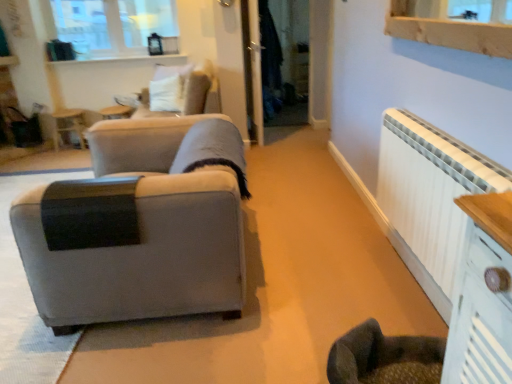
Where is `wooden side table at upper left`? The image size is (512, 384). wooden side table at upper left is located at coordinates (68, 125).

The height and width of the screenshot is (384, 512). What do you see at coordinates (180, 92) in the screenshot?
I see `velvet beige swivel chair at upper center` at bounding box center [180, 92].

I want to click on matte gray fabric couch at left, so click(141, 233).

What is the approximate height of matte gray fabric couch at left?

29.20 inches.

Based on the photo, measure the distance between clear glass window at upper left and camera.

clear glass window at upper left is 4.70 meters away from camera.

What do you see at coordinates (429, 197) in the screenshot? The height and width of the screenshot is (384, 512). I see `white painted radiator at right` at bounding box center [429, 197].

Where is `wooden side table at upper left`? wooden side table at upper left is located at coordinates (68, 125).

Would you say white painted radiator at right is a long distance from transparent glass door at center?

white painted radiator at right is positioned a significant distance from transparent glass door at center.

Which point is more forward, (453, 279) or (280, 125)?

The point (453, 279) is more forward.

Is white painted radiator at right turned away from transparent glass door at center?

No, transparent glass door at center is not at the back of white painted radiator at right.

Which of these two, white painted radiator at right or transparent glass door at center, stands shorter?

With less height is white painted radiator at right.

Based on the photo, from a real-world perspective, between velvet beige swivel chair at upper center and matte gray fabric couch at left, who is vertically higher?

velvet beige swivel chair at upper center, from a real-world perspective.

Would you say velvet beige swivel chair at upper center is a long distance from matte gray fabric couch at left?

Indeed, velvet beige swivel chair at upper center is not near matte gray fabric couch at left.

Does velvet beige swivel chair at upper center have a lesser width compared to matte gray fabric couch at left?

Yes.

From the image's perspective, is velvet beige swivel chair at upper center over matte gray fabric couch at left?

Yes, from the image's perspective, velvet beige swivel chair at upper center is over matte gray fabric couch at left.

Between velvet beige swivel chair at upper center and clear glass window at upper left, which one appears on the left side from the viewer's perspective?

From the viewer's perspective, clear glass window at upper left appears more on the left side.

Image resolution: width=512 pixels, height=384 pixels. I want to click on window located above the velvet beige swivel chair at upper center (from a real-world perspective), so click(x=115, y=26).

In the scene shown: Can you confirm if velvet beige swivel chair at upper center is shorter than clear glass window at upper left?

Yes, velvet beige swivel chair at upper center is shorter than clear glass window at upper left.

Which object is further away from the camera taking this photo, velvet beige swivel chair at upper center or clear glass window at upper left?

clear glass window at upper left is further away from the camera.

Which object is positioned more to the right, clear glass window at upper left or white glossy ledge at upper center?

white glossy ledge at upper center.

Is clear glass window at upper left aimed at white glossy ledge at upper center?

No, clear glass window at upper left is not facing towards white glossy ledge at upper center.

Is point (73, 3) closer to camera compared to point (156, 63)?

That is False.

Who is shorter, clear glass window at upper left or white glossy ledge at upper center?

With less height is white glossy ledge at upper center.

Between wooden side table at upper left and velvet beige swivel chair at upper center, which one is positioned behind?

wooden side table at upper left is further from the camera.

Which is more to the left, wooden side table at upper left or velvet beige swivel chair at upper center?

wooden side table at upper left.

Is wooden side table at upper left positioned with its back to velvet beige swivel chair at upper center?

No, wooden side table at upper left is not facing away from velvet beige swivel chair at upper center.

Image resolution: width=512 pixels, height=384 pixels. Identify the location of side table behind the velvet beige swivel chair at upper center. (68, 125).

In terms of width, does matte gray fabric couch at left look wider or thinner when compared to transparent glass door at center?

matte gray fabric couch at left is wider than transparent glass door at center.

Which of these two, matte gray fabric couch at left or transparent glass door at center, is smaller?

Smaller between the two is transparent glass door at center.

Are matte gray fabric couch at left and transparent glass door at center far apart?

Absolutely, matte gray fabric couch at left is distant from transparent glass door at center.

Can you confirm if white glossy ledge at upper center is positioned to the left of transparent glass door at center?

Correct, you'll find white glossy ledge at upper center to the left of transparent glass door at center.

Is white glossy ledge at upper center bigger or smaller than transparent glass door at center?

Clearly, white glossy ledge at upper center is smaller in size than transparent glass door at center.

Which is in front, point (150, 56) or point (263, 102)?

Positioned in front is point (263, 102).

Is white glossy ledge at upper center turned away from transparent glass door at center?

No, white glossy ledge at upper center's orientation is not away from transparent glass door at center.

There is a white painted radiator at right. In order to click on glass door above it (from a real-world perspective) in this screenshot , I will do `click(285, 61)`.

You are a GUI agent. You are given a task and a screenshot of the screen. Output one action in this format:
    pyautogui.click(x=<x>, y=<y>)
    Task: Click on the swivel chair that appears on the left of matte gray fabric couch at left
    
    Given the screenshot: What is the action you would take?
    click(180, 92)

When comparing their distances from wooden side table at upper left, does white glossy ledge at upper center or clear glass window at upper left seem further?

clear glass window at upper left is positioned further to the anchor wooden side table at upper left.

Based on their spatial positions, is wooden side table at upper left or white glossy ledge at upper center closer to transparent glass door at center?

white glossy ledge at upper center lies closer to transparent glass door at center than the other object.

Which object lies further to the anchor point wooden side table at upper left, velvet beige swivel chair at upper center or matte gray fabric couch at left?

Based on the image, matte gray fabric couch at left appears to be further to wooden side table at upper left.

Which object lies further to the anchor point transparent glass door at center, white glossy ledge at upper center or clear glass window at upper left?

clear glass window at upper left.

Looking at the image, which one is located closer to wooden side table at upper left, white painted radiator at right or matte gray fabric couch at left?

Based on the image, matte gray fabric couch at left appears to be nearer to wooden side table at upper left.

Estimate the real-world distances between objects in this image. Which object is closer to clear glass window at upper left, matte gray fabric couch at left or white glossy ledge at upper center?

white glossy ledge at upper center lies closer to clear glass window at upper left than the other object.

Estimate the real-world distances between objects in this image. Which object is further from clear glass window at upper left, white glossy ledge at upper center or velvet beige swivel chair at upper center?

Among the two, velvet beige swivel chair at upper center is located further to clear glass window at upper left.

Based on their spatial positions, is white glossy ledge at upper center or velvet beige swivel chair at upper center closer to transparent glass door at center?

velvet beige swivel chair at upper center is positioned closer to the anchor transparent glass door at center.

Identify the location of ledge between clear glass window at upper left and transparent glass door at center from left to right. This screenshot has width=512, height=384. (123, 59).

You are a GUI agent. You are given a task and a screenshot of the screen. Output one action in this format:
    pyautogui.click(x=<x>, y=<y>)
    Task: Click on the glass door between matte gray fabric couch at left and white glossy ledge at upper center from front to back
    
    Given the screenshot: What is the action you would take?
    pyautogui.click(x=285, y=61)

Identify the location of side table between matte gray fabric couch at left and white glossy ledge at upper center along the z-axis. pos(68,125).

Locate an element on the screen. This screenshot has height=384, width=512. swivel chair between matte gray fabric couch at left and clear glass window at upper left in the front-back direction is located at coordinates (180, 92).